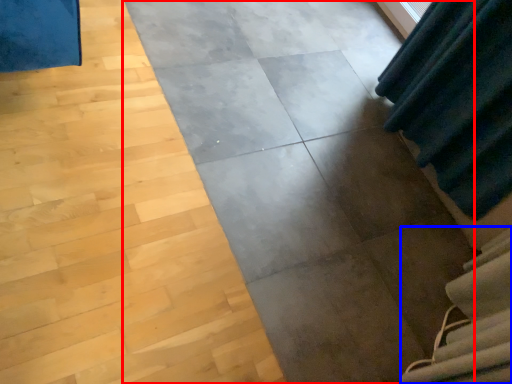
Question: Which point is further to the camera, concrete (highlighted by a red box) or stairwell (highlighted by a blue box)?

Choices:
 (A) concrete
 (B) stairwell

Answer: (B)